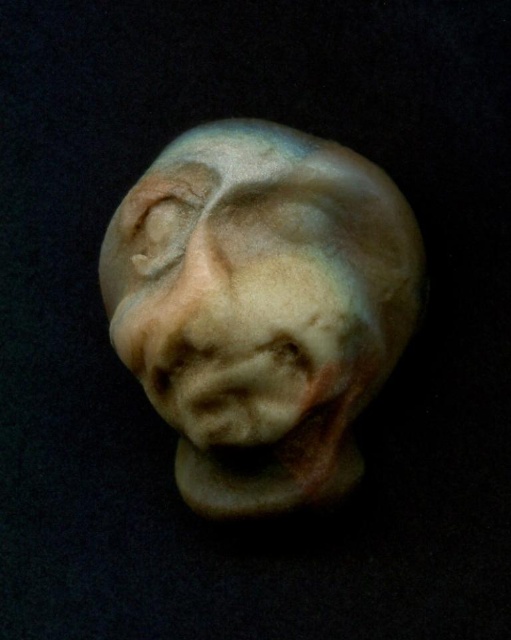
Question: Does matte clay sculpture at center appear on the left side of matte clay nose at center?

Choices:
 (A) yes
 (B) no

Answer: (B)

Question: Can you confirm if matte clay sculpture at center is positioned to the right of matte clay nose at center?

Choices:
 (A) no
 (B) yes

Answer: (B)

Question: Among these objects, which one is nearest to the camera?

Choices:
 (A) matte clay nose at center
 (B) matte clay sculpture at center

Answer: (A)

Question: Where is matte clay sculpture at center located in relation to matte clay nose at center in the image?

Choices:
 (A) right
 (B) left

Answer: (A)

Question: Among these points, which one is nearest to the camera?

Choices:
 (A) (118, 339)
 (B) (307, 145)

Answer: (B)